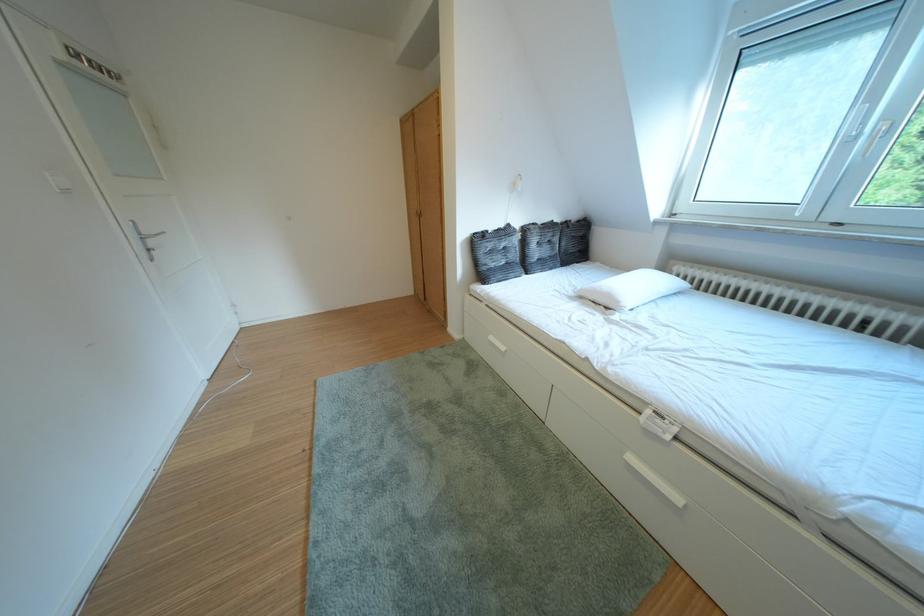
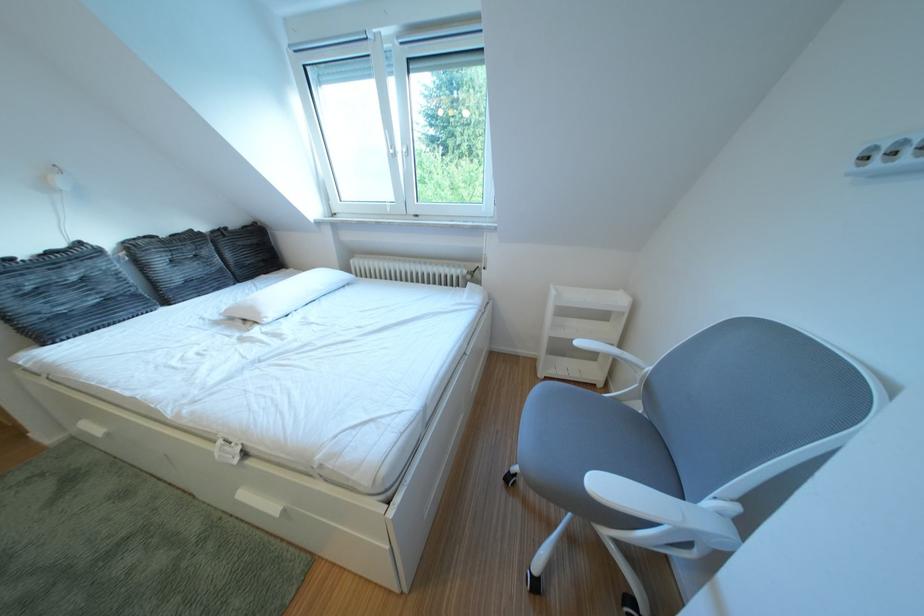
The point at (588, 222) is marked in the first image. Where is the corresponding point in the second image?

(247, 228)